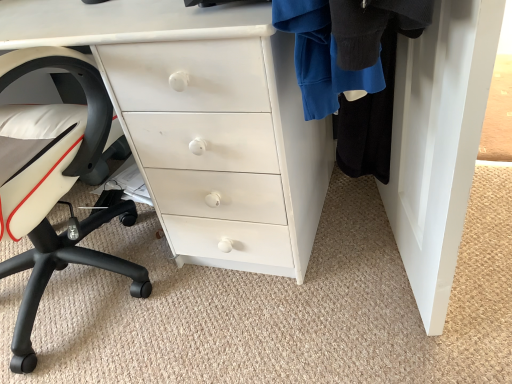
Question: Would you say white matte chair at left is to the left or to the right of white painted wood chest of drawers at center in the picture?

Choices:
 (A) right
 (B) left

Answer: (B)

Question: From the image's perspective, is white matte chair at left located above or below white painted wood chest of drawers at center?

Choices:
 (A) above
 (B) below

Answer: (B)

Question: Considering the positions of white matte chair at left and white painted wood chest of drawers at center in the image, is white matte chair at left wider or thinner than white painted wood chest of drawers at center?

Choices:
 (A) wide
 (B) thin

Answer: (A)

Question: From the image's perspective, is white painted wood chest of drawers at center located above or below white matte chair at left?

Choices:
 (A) above
 (B) below

Answer: (A)

Question: Is white painted wood chest of drawers at center in front of or behind white matte chair at left in the image?

Choices:
 (A) front
 (B) behind

Answer: (B)

Question: Would you say white painted wood chest of drawers at center is to the left or to the right of white matte chair at left in the picture?

Choices:
 (A) right
 (B) left

Answer: (A)

Question: Is white painted wood chest of drawers at center inside or outside of white matte chair at left?

Choices:
 (A) inside
 (B) outside

Answer: (B)